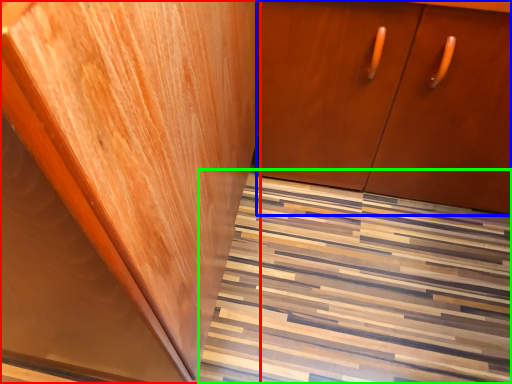
Question: Estimate the real-world distances between objects in this image. Which object is farther from cabinetry (highlighted by a red box), cabinetry (highlighted by a blue box) or stairwell (highlighted by a green box)?

Choices:
 (A) cabinetry
 (B) stairwell

Answer: (B)